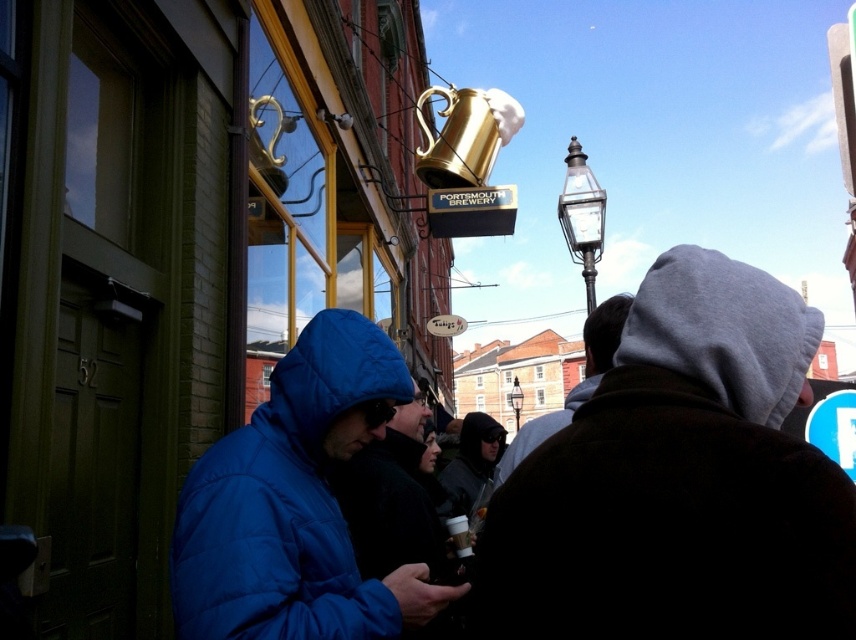
Question: Which point is farther from the camera taking this photo?

Choices:
 (A) [574, 144]
 (B) [776, 307]
 (C) [516, 424]
 (D) [340, 452]

Answer: (C)

Question: Is puffy blue jacket at center smaller than gray fleece jacket at upper right?

Choices:
 (A) no
 (B) yes

Answer: (B)

Question: Which object is the farthest from the blue puffy jacket at center?

Choices:
 (A) gray fleece jacket at upper right
 (B) gray fleece hoodie at upper right

Answer: (B)

Question: Which point appears farthest from the camera in this image?

Choices:
 (A) (510, 396)
 (B) (591, 198)
 (C) (765, 291)

Answer: (A)

Question: Does puffy blue jacket at center appear on the right side of clear glass lamp post at upper right?

Choices:
 (A) yes
 (B) no

Answer: (B)

Question: Can you confirm if puffy blue jacket at center is bigger than clear glass lamp post at upper right?

Choices:
 (A) no
 (B) yes

Answer: (A)